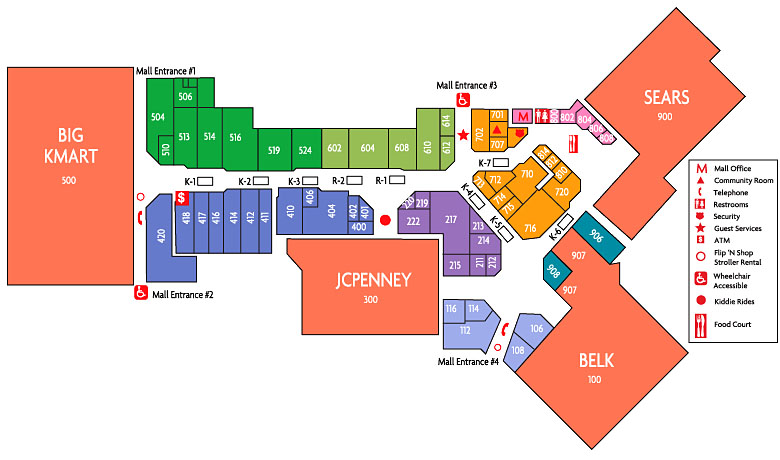
Where is `orange room`? The width and height of the screenshot is (780, 460). orange room is located at coordinates (87, 231), (390, 320), (598, 335), (651, 131).